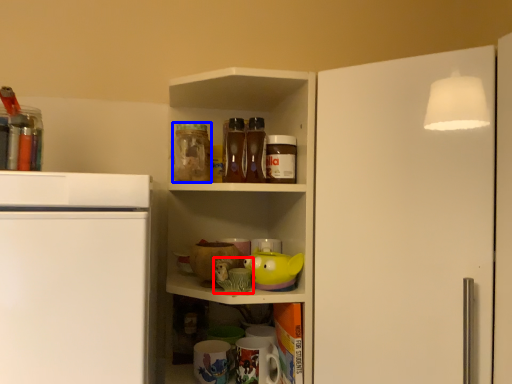
Question: Which object is closer to the camera taking this photo, toy (highlighted by a red box) or beverage (highlighted by a blue box)?

Choices:
 (A) toy
 (B) beverage

Answer: (A)